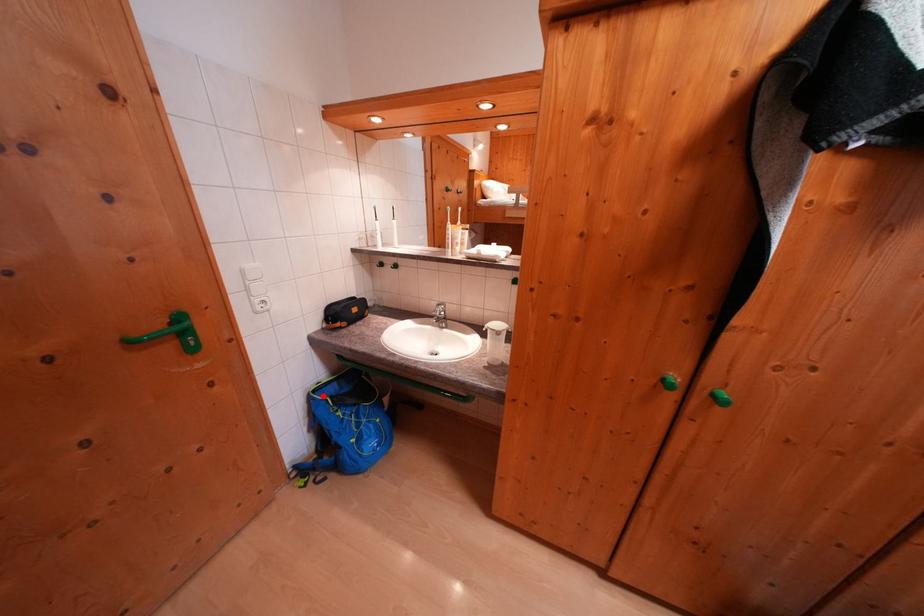
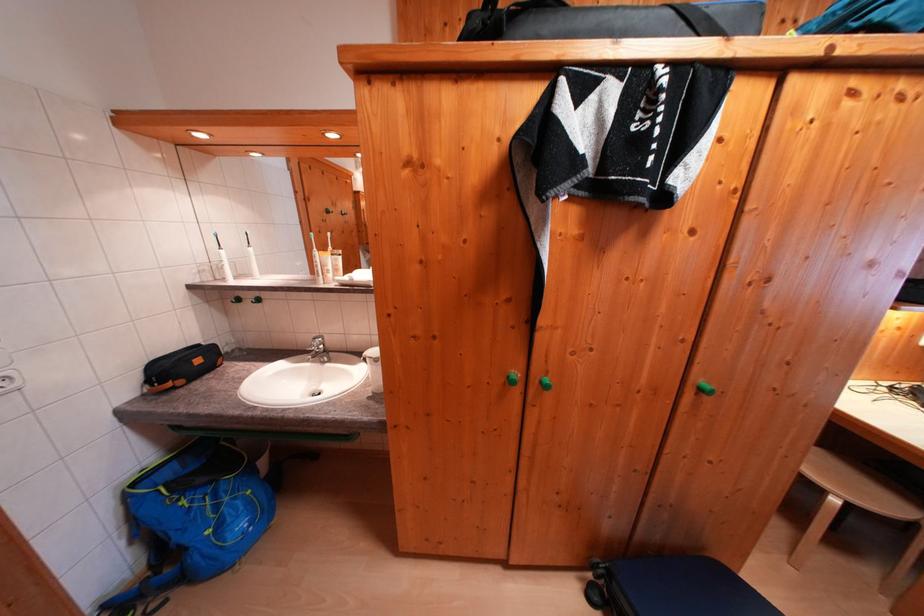
Find the pixel in the second image that matches the highlighted location in the first image.

(142, 488)